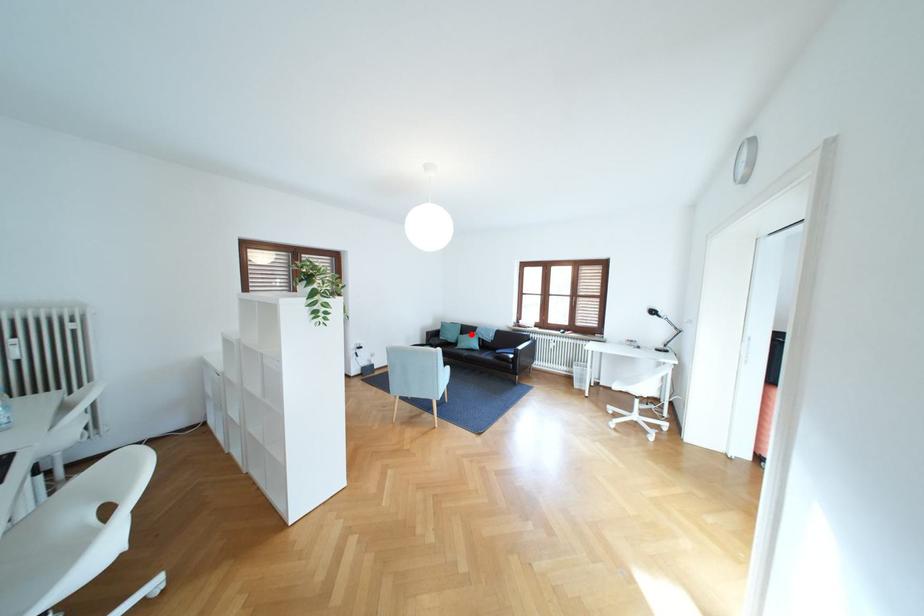
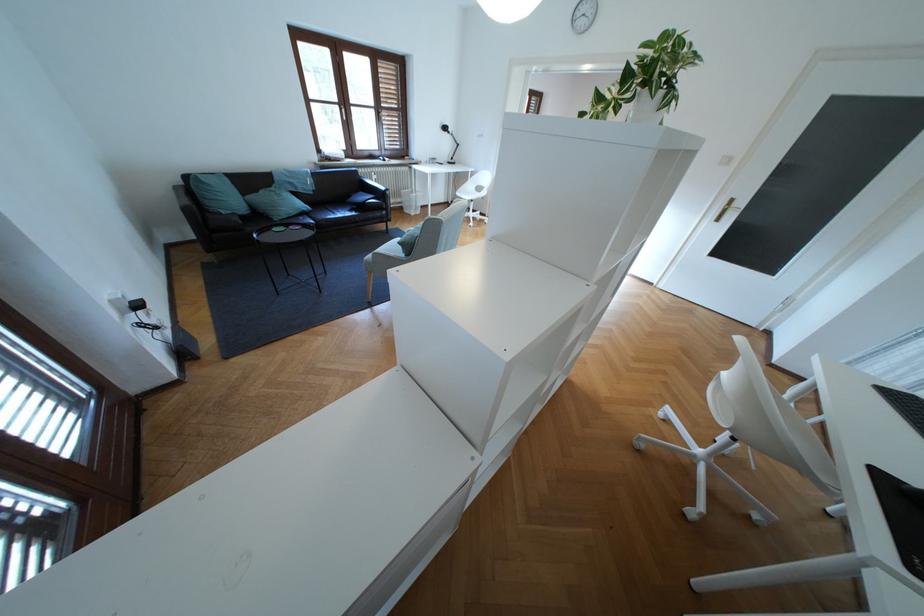
In the second image, find the point that corresponds to the highlighted location in the first image.

(253, 193)